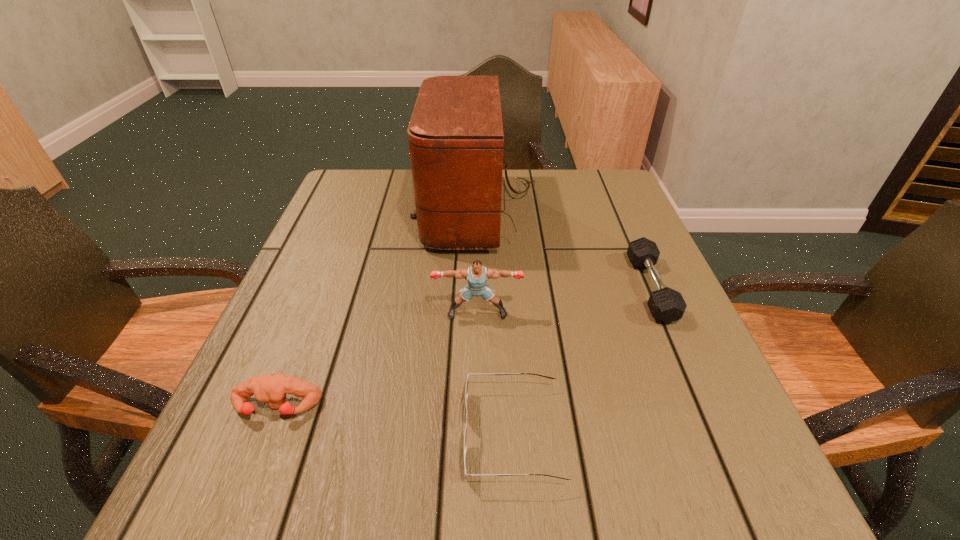
The image size is (960, 540). In order to click on free spot between the sunglasses and the tallest object in this screenshot , I will do `click(497, 323)`.

At what (x,y) coordinates should I click in order to perform the action: click on object that is the second nearest to the dumbbell. Please return your answer as a coordinate pair (x, y). Image resolution: width=960 pixels, height=540 pixels. Looking at the image, I should click on (467, 383).

Identify which object is located as the third nearest to the shortest object. Please provide its 2D coordinates. Your answer should be formatted as a tuple, i.e. [(x, y)], where the tuple contains the x and y coordinates of a point satisfying the conditions above.

[(665, 304)]

You are a GUI agent. You are given a task and a screenshot of the screen. Output one action in this format:
    pyautogui.click(x=<x>, y=<y>)
    Task: Click on the vacant space that satisfies the following two spatial constraints: 1. on the front panel of the tallest object; 2. on the front-facing side of the farther puncher
    
    Given the screenshot: What is the action you would take?
    pyautogui.click(x=481, y=313)

Find the location of a particular element. This screenshot has height=540, width=960. free point that satisfies the following two spatial constraints: 1. on the front panel of the tallest object; 2. with the gloves of the leftmost object facing forward is located at coordinates (481, 407).

Identify the location of free space that satisfies the following two spatial constraints: 1. on the front panel of the rightmost object; 2. on the right side of the radio receiver. The image size is (960, 540). (481, 288).

Image resolution: width=960 pixels, height=540 pixels. What are the coordinates of `blank area in the image that satisfies the following two spatial constraints: 1. on the front panel of the tallest object; 2. with the gloves of the shorter puncher facing forward` in the screenshot? It's located at (481, 407).